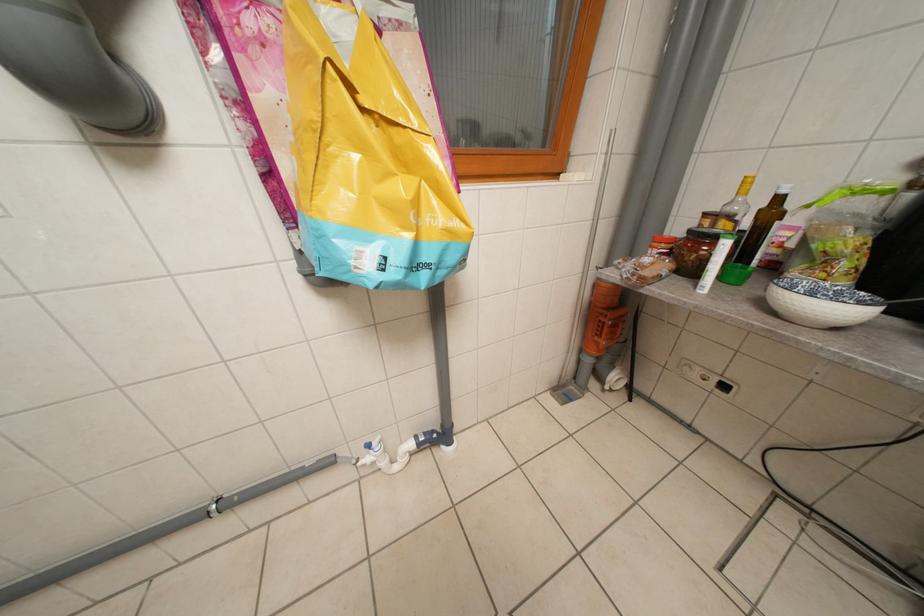
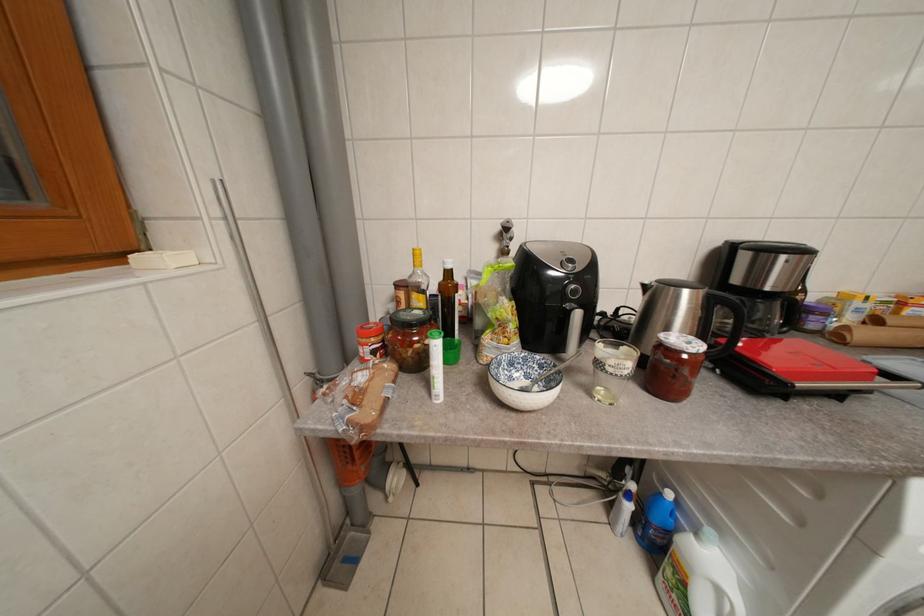
Question: How did the camera likely rotate?

Choices:
 (A) Left
 (B) Right
 (C) Up
 (D) Down

Answer: (B)